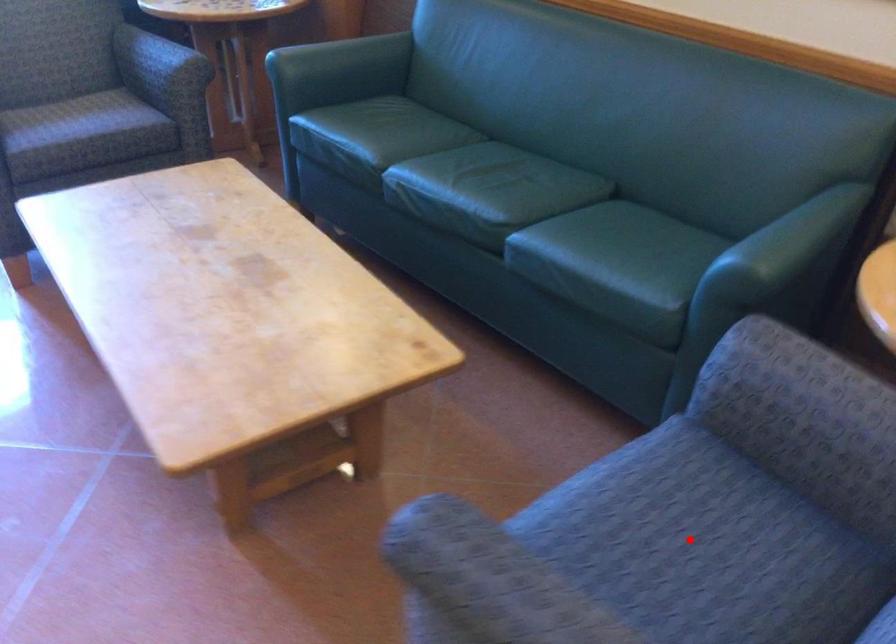
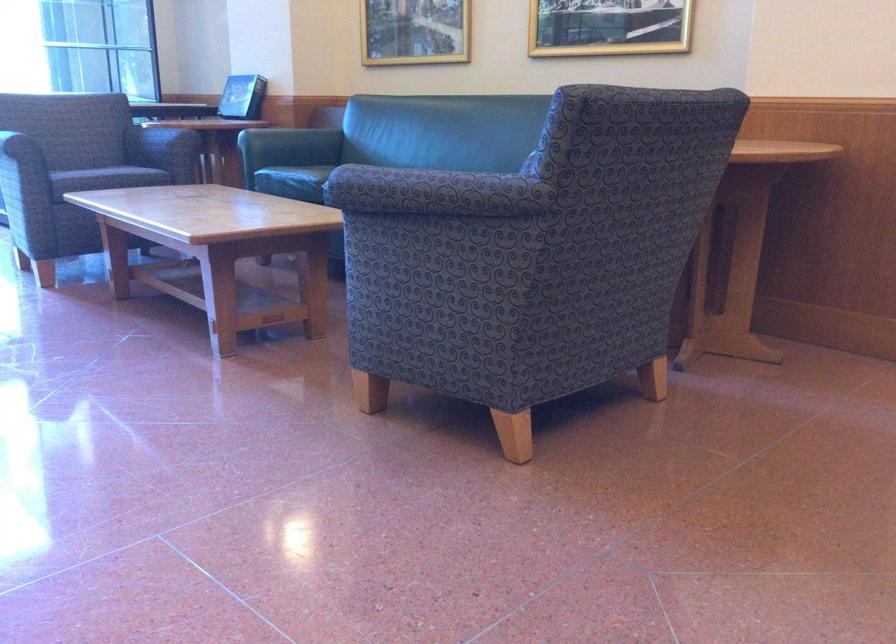
Question: I am providing you with two images of the same scene from different viewpoints. A red point is marked on the first image. At the location where the point appears in image 1, is it still visible in image 2?

Choices:
 (A) Yes
 (B) No

Answer: (B)